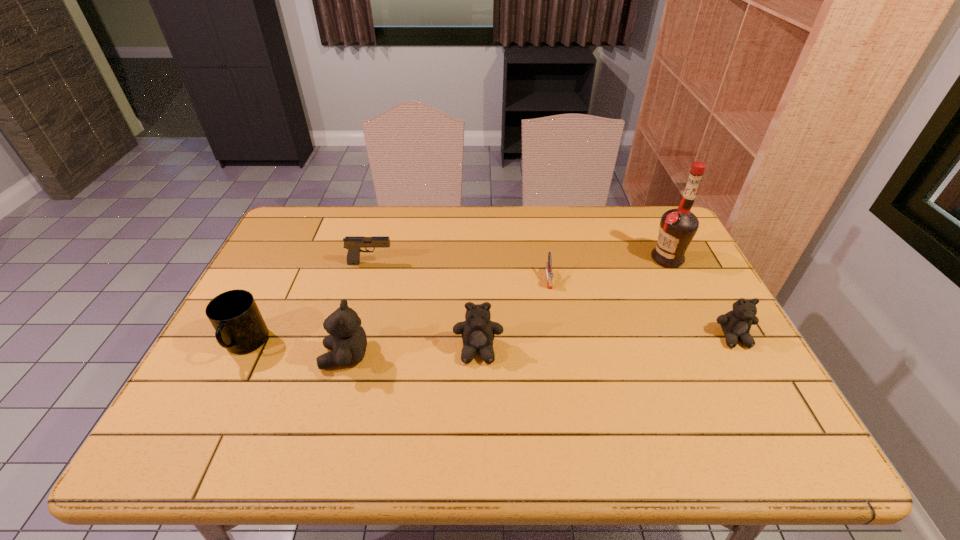
The image size is (960, 540). Identify the location of vacant area that satisfies the following two spatial constraints: 1. on the handle side of the stapler; 2. on the face of the leftmost teddy bear. (562, 357).